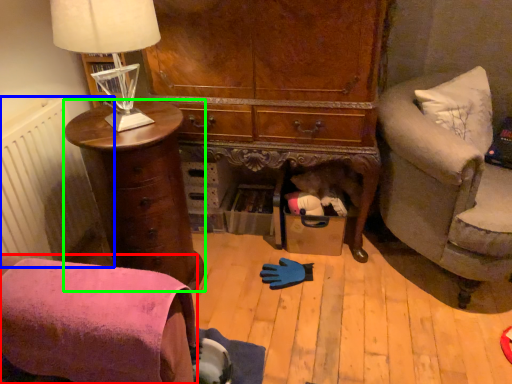
Question: Which object is positioned farthest from chair (highlighted by a red box)? Select from radiator (highlighted by a blue box) and chest of drawers (highlighted by a green box).

Choices:
 (A) radiator
 (B) chest of drawers

Answer: (A)